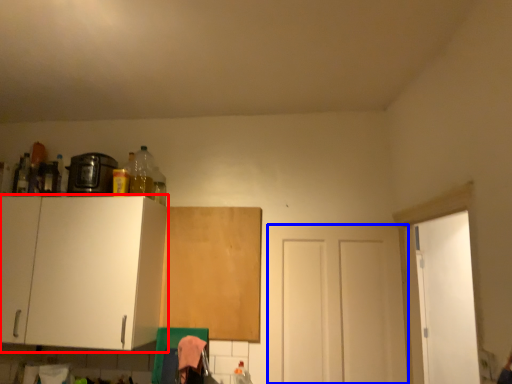
Question: Which object is closer to the camera taking this photo, cabinetry (highlighted by a red box) or door (highlighted by a blue box)?

Choices:
 (A) cabinetry
 (B) door

Answer: (A)